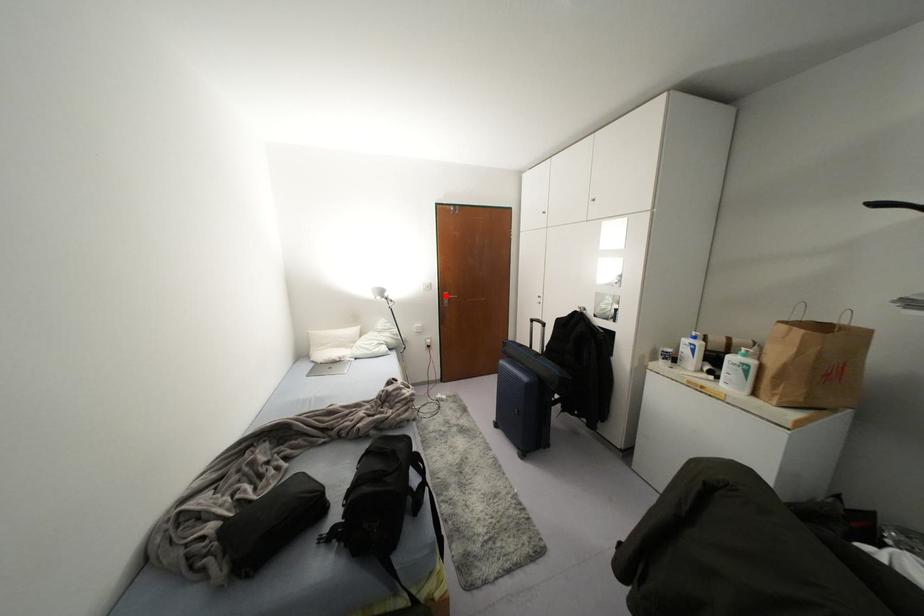
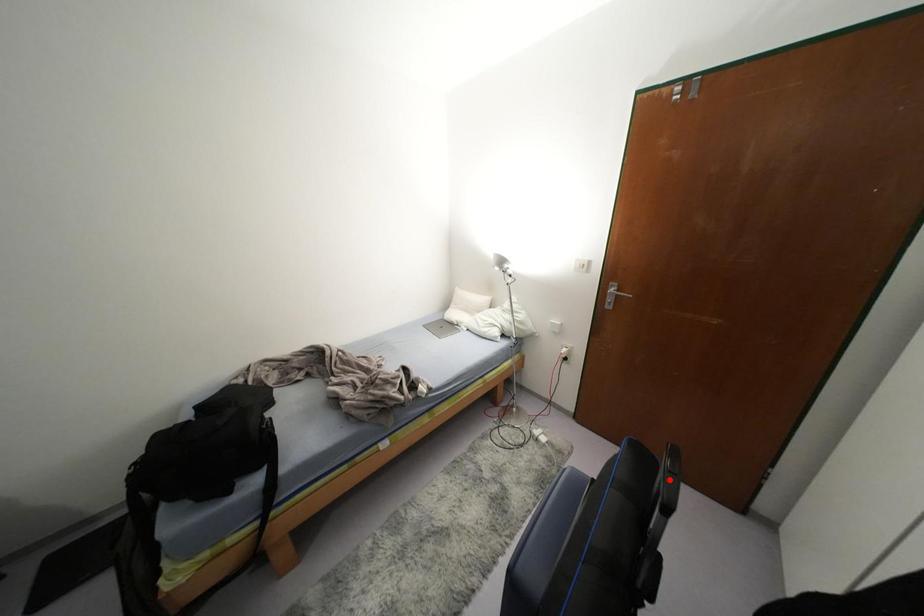
I am providing you with two images of the same scene from different viewpoints. A red point is marked on the first image and another point is marked on the second image. Is the red point in image1 aligned with the point shown in image2?

No